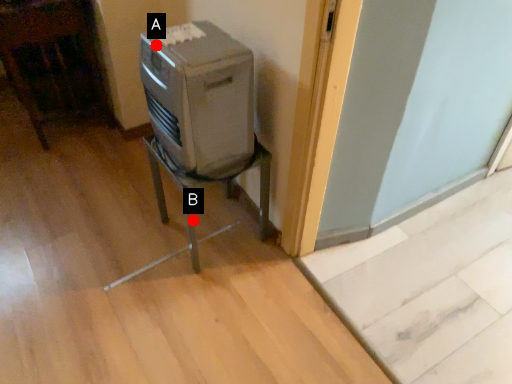
Question: Two points are circled on the image, labeled by A and B beside each circle. Which point is closer to the camera?

Choices:
 (A) A is closer
 (B) B is closer

Answer: (A)